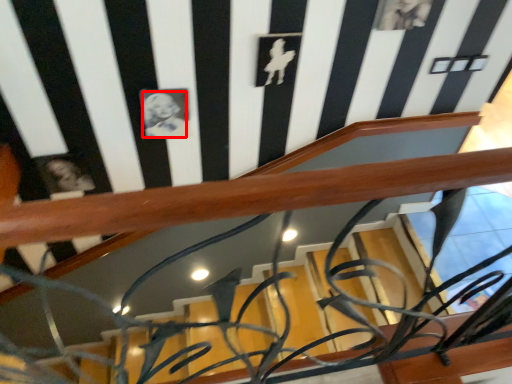
Question: From the image's perspective, where is art (annotated by the red box) located in relation to art in the image?

Choices:
 (A) below
 (B) above

Answer: (B)